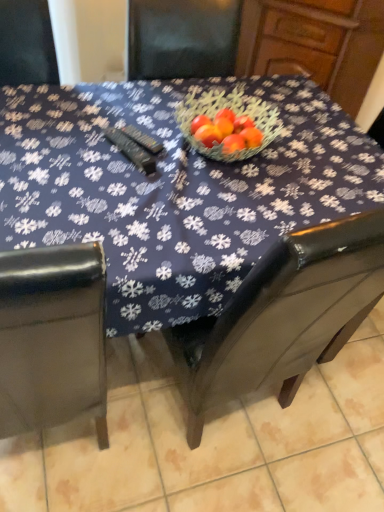
At what (x,y) coordinates should I click in order to perform the action: click on empty space that is ontop of brown leather chair at lower right (from a real-world perspective). Please return your answer as a coordinate pair (x, y). Looking at the image, I should click on (244, 436).